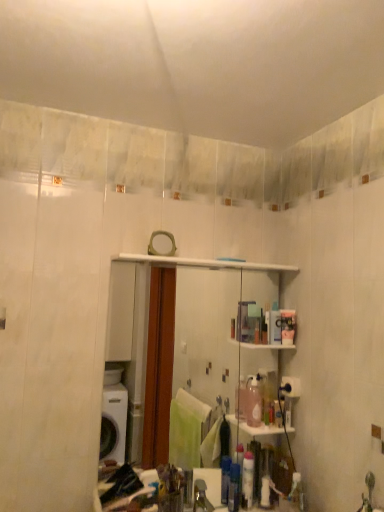
Question: In the image, is clear glass mirror at center positioned in front of or behind metallic silver faucet at lower center?

Choices:
 (A) behind
 (B) front

Answer: (A)

Question: From the image's perspective, relative to metallic silver faucet at lower center, is clear glass mirror at center above or below?

Choices:
 (A) above
 (B) below

Answer: (A)

Question: Estimate the real-world distances between objects in this image. Which object is farther from the translucent plastic container at upper right?

Choices:
 (A) clear glass mirror at center
 (B) metallic silver faucet at lower center

Answer: (B)

Question: Which is farther from the clear glass mirror at center?

Choices:
 (A) metallic silver faucet at lower center
 (B) translucent plastic container at upper right

Answer: (A)